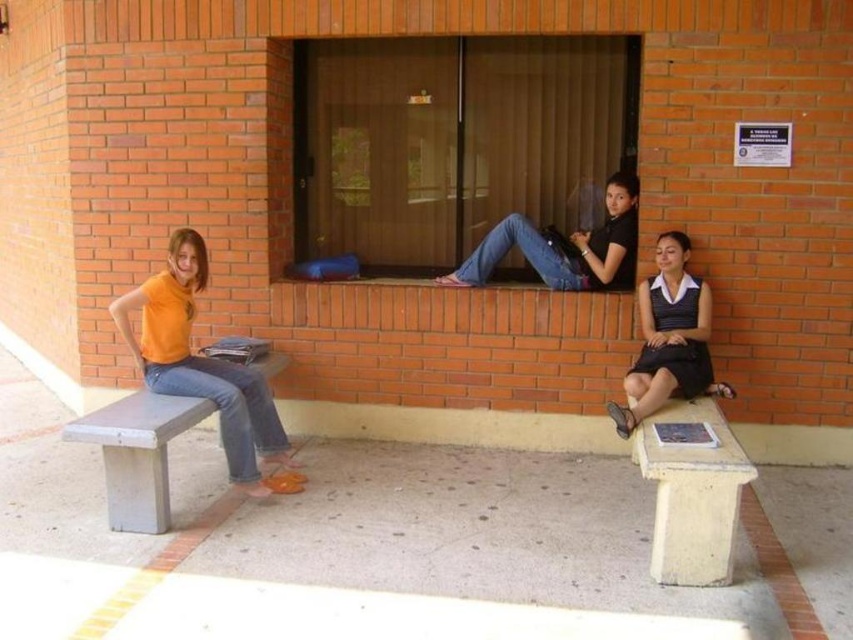
Question: Based on their relative distances, which object is farther from the matte glass window at center?

Choices:
 (A) orange matte shirt at left
 (B) concrete bench at left
 (C) light beige wood park bench at lower right

Answer: (B)

Question: Considering the real-world distances, which object is farthest from the light beige wood park bench at lower right?

Choices:
 (A) concrete bench at left
 (B) matte glass window at center
 (C) matte black dress at lower right

Answer: (A)

Question: Is matte glass window at center closer to camera compared to orange matte shirt at left?

Choices:
 (A) yes
 (B) no

Answer: (B)

Question: Does matte glass window at center appear under concrete bench at left?

Choices:
 (A) yes
 (B) no

Answer: (B)

Question: Among these objects, which one is farthest from the camera?

Choices:
 (A) matte glass window at center
 (B) orange matte shirt at left

Answer: (A)

Question: Can you confirm if matte glass window at center is positioned to the left of matte black dress at lower right?

Choices:
 (A) no
 (B) yes

Answer: (B)